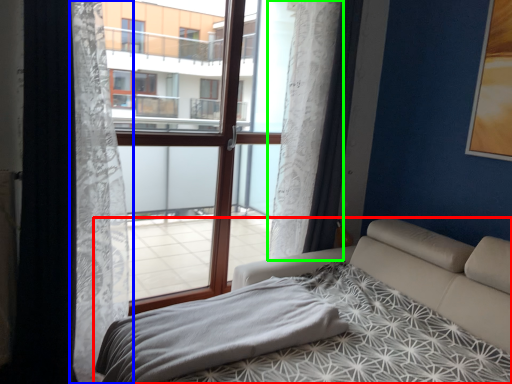
Question: Based on their relative distances, which object is nearer to bed (highlighted by a red box)? Choose from curtain (highlighted by a blue box) and curtain (highlighted by a green box).

Choices:
 (A) curtain
 (B) curtain

Answer: (B)